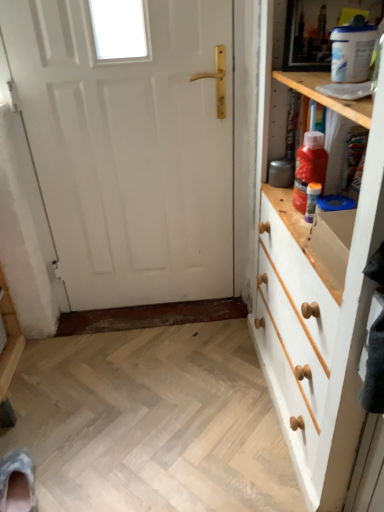
Describe the element at coordinates (309, 167) in the screenshot. I see `red plastic bottle at upper right, arranged as the first bottle when viewed from the top` at that location.

In order to click on camouflage fabric shoe at lower left in this screenshot , I will do `click(17, 483)`.

What do you see at coordinates (312, 200) in the screenshot?
I see `translucent plastic bottle at upper right, which is counted as the first bottle, starting from the bottom` at bounding box center [312, 200].

Locate an element on the screen. The image size is (384, 512). red plastic bottle at upper right, arranged as the first bottle when viewed from the top is located at coordinates (309, 167).

From the image's perspective, which is below, camouflage fabric shoe at lower left or translucent plastic bottle at upper right, which is the second bottle from top to bottom?

camouflage fabric shoe at lower left appears lower in the image.

From the picture: Which object is thinner, camouflage fabric shoe at lower left or translucent plastic bottle at upper right, which is counted as the first bottle, starting from the bottom?

With smaller width is translucent plastic bottle at upper right, which is counted as the first bottle, starting from the bottom.

From a real-world perspective, is camouflage fabric shoe at lower left below translucent plastic bottle at upper right, which is counted as the first bottle, starting from the bottom?

Indeed, from a real-world perspective, camouflage fabric shoe at lower left is positioned beneath translucent plastic bottle at upper right, which is counted as the first bottle, starting from the bottom.

Is camouflage fabric shoe at lower left facing away from translucent plastic bottle at upper right, which is the second bottle from top to bottom?

No, camouflage fabric shoe at lower left's orientation is not away from translucent plastic bottle at upper right, which is the second bottle from top to bottom.

You are a GUI agent. You are given a task and a screenshot of the screen. Output one action in this format:
    pyautogui.click(x=<x>, y=<y>)
    Task: Click on the 2nd bottle located above the white painted wood chest of drawers at right (from a real-world perspective)
    The height and width of the screenshot is (512, 384).
    Given the screenshot: What is the action you would take?
    pyautogui.click(x=309, y=167)

Is white painted wood chest of drawers at right inside red plastic bottle at upper right, arranged as the first bottle when viewed from the top?

No, white painted wood chest of drawers at right is not inside red plastic bottle at upper right, arranged as the first bottle when viewed from the top.

Looking at this image, which is farther from the camera, (295, 163) or (333, 383)?

Point (295, 163)

Is camouflage fabric shoe at lower left turned away from white matte door at center?

No, camouflage fabric shoe at lower left is not facing away from white matte door at center.

Between camouflage fabric shoe at lower left and white matte door at center, which one has more height?

With more height is white matte door at center.

From a real-world perspective, relative to white matte door at center, is camouflage fabric shoe at lower left vertically above or below?

camouflage fabric shoe at lower left is below white matte door at center.

Can white matte door at center be found inside camouflage fabric shoe at lower left?

No, camouflage fabric shoe at lower left does not contain white matte door at center.

Consider the image. From the image's perspective, which one is positioned lower, translucent plastic bottle at upper right, which is counted as the first bottle, starting from the bottom, or camouflage fabric shoe at lower left?

camouflage fabric shoe at lower left.

Is translucent plastic bottle at upper right, which is counted as the first bottle, starting from the bottom, positioned with its back to camouflage fabric shoe at lower left?

translucent plastic bottle at upper right, which is counted as the first bottle, starting from the bottom, is not turned away from camouflage fabric shoe at lower left.

Considering the relative positions of translucent plastic bottle at upper right, which is the second bottle from top to bottom, and camouflage fabric shoe at lower left in the image provided, is translucent plastic bottle at upper right, which is the second bottle from top to bottom, behind camouflage fabric shoe at lower left?

Yes, translucent plastic bottle at upper right, which is the second bottle from top to bottom, is behind camouflage fabric shoe at lower left.

Which of these two, translucent plastic bottle at upper right, which is counted as the first bottle, starting from the bottom, or camouflage fabric shoe at lower left, is thinner?

With smaller width is translucent plastic bottle at upper right, which is counted as the first bottle, starting from the bottom.

Based on the photo, which point is more forward, (268, 285) or (181, 264)?

The point (268, 285) is closer to the camera.

From the image's perspective, is white painted wood chest of drawers at right over white matte door at center?

No, from the image's perspective, white painted wood chest of drawers at right is not over white matte door at center.

Is white painted wood chest of drawers at right positioned beyond the bounds of white matte door at center?

Yes, white painted wood chest of drawers at right is outside of white matte door at center.

Is white matte door at center at the back of white painted wood chest of drawers at right?

white painted wood chest of drawers at right is not turned away from white matte door at center.

Considering the points (320, 161) and (153, 108), which point is in front, point (320, 161) or point (153, 108)?

The point (320, 161) is closer.

Is there a large distance between red plastic bottle at upper right, the 2th bottle in the bottom-to-top sequence, and white matte door at center?

red plastic bottle at upper right, the 2th bottle in the bottom-to-top sequence, is actually quite close to white matte door at center.

From the image's perspective, is red plastic bottle at upper right, the 2th bottle in the bottom-to-top sequence, beneath white matte door at center?

Yes.

Consider the image. Would you say white matte door at center is to the left or to the right of red plastic bottle at upper right, the 2th bottle in the bottom-to-top sequence, in the picture?

From the image, it's evident that white matte door at center is to the left of red plastic bottle at upper right, the 2th bottle in the bottom-to-top sequence.

Between white matte door at center and red plastic bottle at upper right, the 2th bottle in the bottom-to-top sequence, which one has more height?

With more height is white matte door at center.

From a real-world perspective, is white matte door at center above or below red plastic bottle at upper right, the 2th bottle in the bottom-to-top sequence?

white matte door at center is situated lower than red plastic bottle at upper right, the 2th bottle in the bottom-to-top sequence, in the real world.

Where is `bottle that is the 1st one above the camouflage fabric shoe at lower left (from a real-world perspective)`? The height and width of the screenshot is (512, 384). bottle that is the 1st one above the camouflage fabric shoe at lower left (from a real-world perspective) is located at coordinates (312, 200).

You are a GUI agent. You are given a task and a screenshot of the screen. Output one action in this format:
    pyautogui.click(x=<x>, y=<y>)
    Task: Click on the 1st bottle behind the white painted wood chest of drawers at right, counting from the anchor's position
    The width and height of the screenshot is (384, 512).
    Given the screenshot: What is the action you would take?
    (x=309, y=167)

Which object lies nearer to the anchor point red plastic bottle at upper right, arranged as the first bottle when viewed from the top, white matte door at center or translucent plastic bottle at upper right, which is counted as the first bottle, starting from the bottom?

translucent plastic bottle at upper right, which is counted as the first bottle, starting from the bottom.

In the scene shown: Considering their positions, is white matte door at center positioned further to white painted wood chest of drawers at right than translucent plastic bottle at upper right, which is counted as the first bottle, starting from the bottom?

white matte door at center is positioned further to the anchor white painted wood chest of drawers at right.

Estimate the real-world distances between objects in this image. Which object is further from white matte door at center, translucent plastic bottle at upper right, which is the second bottle from top to bottom, or white painted wood chest of drawers at right?

translucent plastic bottle at upper right, which is the second bottle from top to bottom, is positioned further to the anchor white matte door at center.

Considering their positions, is white painted wood chest of drawers at right positioned closer to white matte door at center than red plastic bottle at upper right, the 2th bottle in the bottom-to-top sequence?

Based on the image, white painted wood chest of drawers at right appears to be nearer to white matte door at center.

Considering their positions, is white matte door at center positioned closer to red plastic bottle at upper right, arranged as the first bottle when viewed from the top, than camouflage fabric shoe at lower left?

The object closer to red plastic bottle at upper right, arranged as the first bottle when viewed from the top, is white matte door at center.

Looking at the image, which one is located further to white painted wood chest of drawers at right, translucent plastic bottle at upper right, which is the second bottle from top to bottom, or camouflage fabric shoe at lower left?

camouflage fabric shoe at lower left is positioned further to the anchor white painted wood chest of drawers at right.

Estimate the real-world distances between objects in this image. Which object is closer to white matte door at center, camouflage fabric shoe at lower left or translucent plastic bottle at upper right, which is counted as the first bottle, starting from the bottom?

translucent plastic bottle at upper right, which is counted as the first bottle, starting from the bottom, is closer to white matte door at center.

From the image, which object appears to be farther from white painted wood chest of drawers at right, camouflage fabric shoe at lower left or translucent plastic bottle at upper right, which is the second bottle from top to bottom?

camouflage fabric shoe at lower left is positioned further to the anchor white painted wood chest of drawers at right.

Where is `bottle between white matte door at center and translucent plastic bottle at upper right, which is the second bottle from top to bottom, from left to right`? The height and width of the screenshot is (512, 384). bottle between white matte door at center and translucent plastic bottle at upper right, which is the second bottle from top to bottom, from left to right is located at coordinates (309, 167).

Locate an element on the screen. bottle between red plastic bottle at upper right, arranged as the first bottle when viewed from the top, and camouflage fabric shoe at lower left vertically is located at coordinates (312, 200).

The width and height of the screenshot is (384, 512). Identify the location of bottle located between white painted wood chest of drawers at right and translucent plastic bottle at upper right, which is counted as the first bottle, starting from the bottom, in the depth direction. (309, 167).

Where is `the chest of drawers that lies between white matte door at center and camouflage fabric shoe at lower left from top to bottom`? the chest of drawers that lies between white matte door at center and camouflage fabric shoe at lower left from top to bottom is located at coordinates [319, 320].